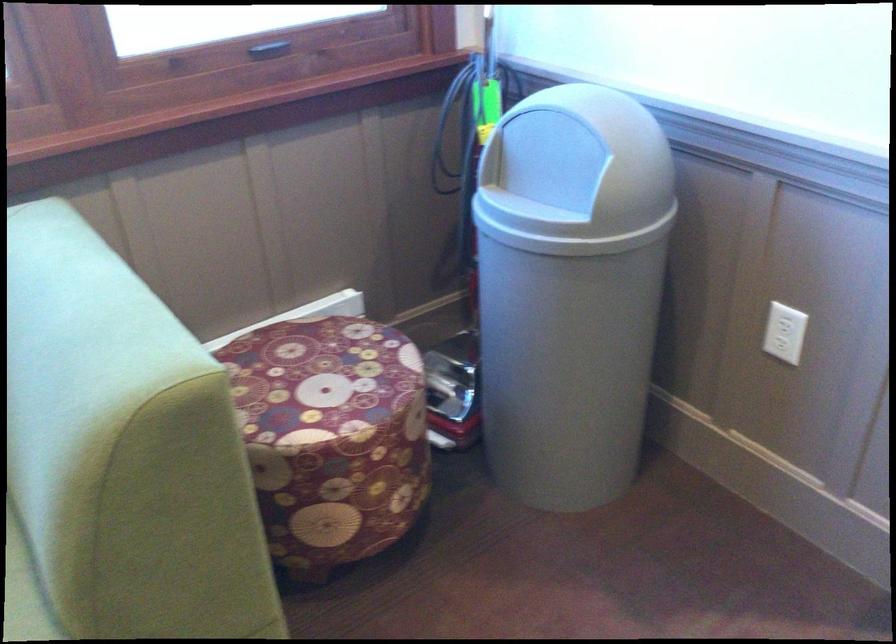
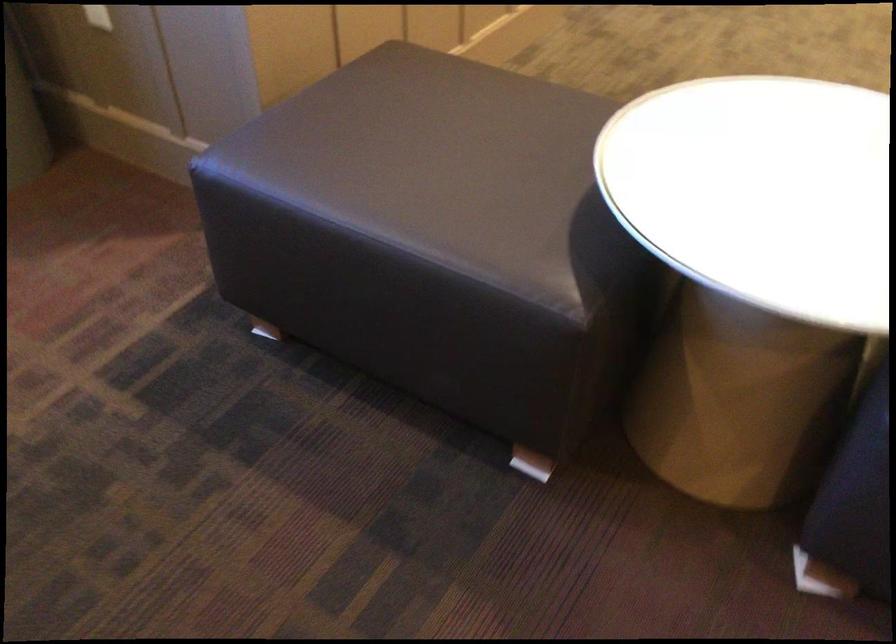
In a continuous first-person perspective shot, in which direction is the camera moving?

The cameraman walked toward right, backward.